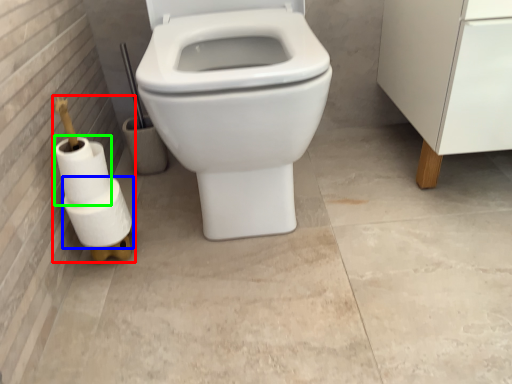
Question: Considering the real-world distances, which object is closest to toilet paper (highlighted by a red box)? toilet paper (highlighted by a blue box) or toilet paper (highlighted by a green box).

Choices:
 (A) toilet paper
 (B) toilet paper

Answer: (A)